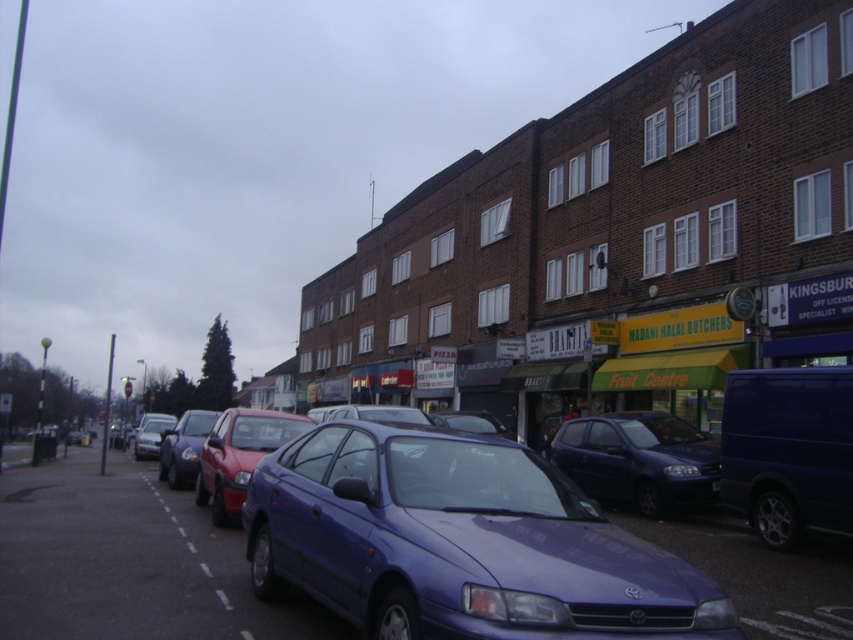
Question: Does matte blue hatchback at center appear under matte silver car at center?

Choices:
 (A) no
 (B) yes

Answer: (A)

Question: Among these points, which one is nearest to the camera?

Choices:
 (A) (560, 579)
 (B) (160, 432)

Answer: (A)

Question: Estimate the real-world distances between objects in this image. Which object is closer to the matte blue hatchback at center?

Choices:
 (A) matte silver car at center
 (B) glossy metallic car at center
 (C) metallic blue sedan at center

Answer: (B)

Question: Can you confirm if glossy metallic car at center is positioned below matte blue hatchback at center?

Choices:
 (A) no
 (B) yes

Answer: (A)

Question: Which object is farther from the camera taking this photo?

Choices:
 (A) matte silver car at center
 (B) glossy metallic car at center

Answer: (A)

Question: Does glossy metallic car at center have a greater width compared to matte blue hatchback at center?

Choices:
 (A) yes
 (B) no

Answer: (A)